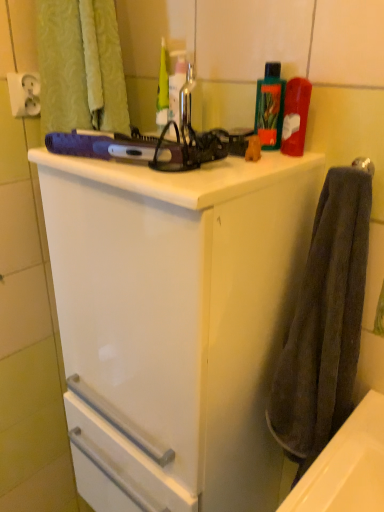
Question: From a real-world perspective, is green plastic bottle at upper right physically located above or below translucent plastic bottle at upper center?

Choices:
 (A) above
 (B) below

Answer: (B)

Question: Is green plastic bottle at upper right taller or shorter than translucent plastic bottle at upper center?

Choices:
 (A) tall
 (B) short

Answer: (B)

Question: Based on their relative distances, which object is nearer to the white glossy cabinet at upper center?

Choices:
 (A) translucent plastic bottle at upper center
 (B) metallic silver faucet at upper center
 (C) green plastic bottle at upper right
 (D) dark gray towel at right
 (E) white plastic socket at upper left

Answer: (D)

Question: Which object is the farthest from the white plastic socket at upper left?

Choices:
 (A) white glossy cabinet at upper center
 (B) green plastic bottle at upper right
 (C) metallic silver faucet at upper center
 (D) translucent plastic bottle at upper center
 (E) dark gray towel at right

Answer: (E)